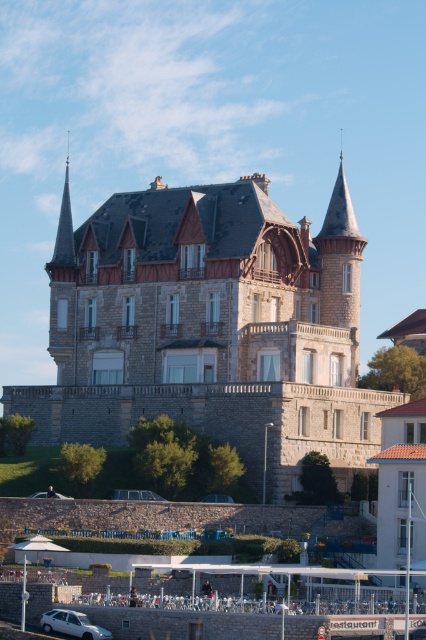
You are a photographer planning to take a picture of the stone castle at center and the white matte car at lower left from a distance. Which object will appear larger in the photo?

The stone castle at center will appear larger in the photo because it is taller than the white matte car at lower left.

You are a delivery person needing to reach the stone castle at center from the white matte car at lower left. The road is 3 meters wide. Can your car, which is 2 meters wide, safely navigate the path between them?

The distance between the stone castle at center and the white matte car at lower left is 29.67 meters. Since the road is 3 meters wide and your car is only 2 meters wide, the car can safely navigate the path between them.

You are standing on the lawn in front of the stone castle at center and want to walk to the white matte car at lower left. Which direction should you head towards?

Since the stone castle at center is to the right of the white matte car at lower left, you should head towards the left direction to reach the white matte car at lower left.